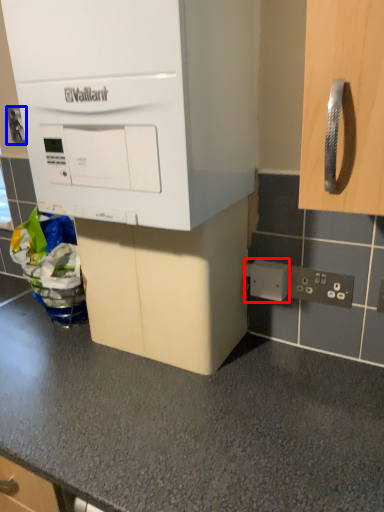
Question: Which object appears farthest to the camera in this image, electric outlet (highlighted by a red box) or electric outlet (highlighted by a blue box)?

Choices:
 (A) electric outlet
 (B) electric outlet

Answer: (B)